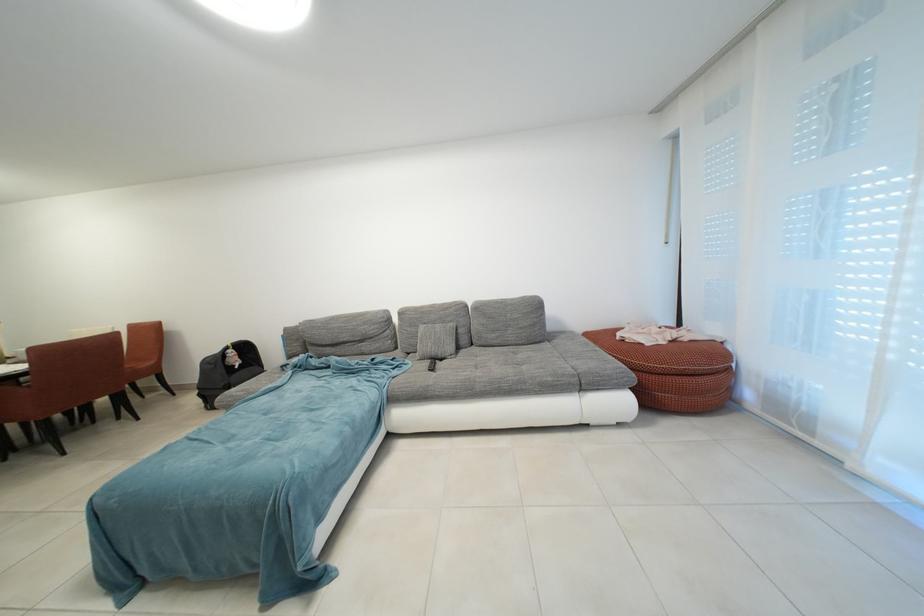
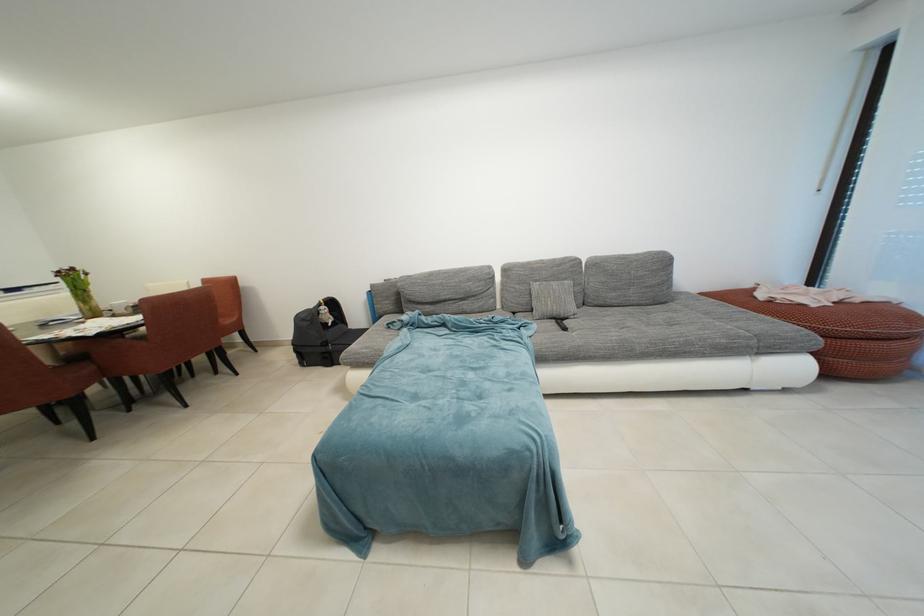
Find the pixel in the second image that matches [434,368] in the first image.

(560, 328)